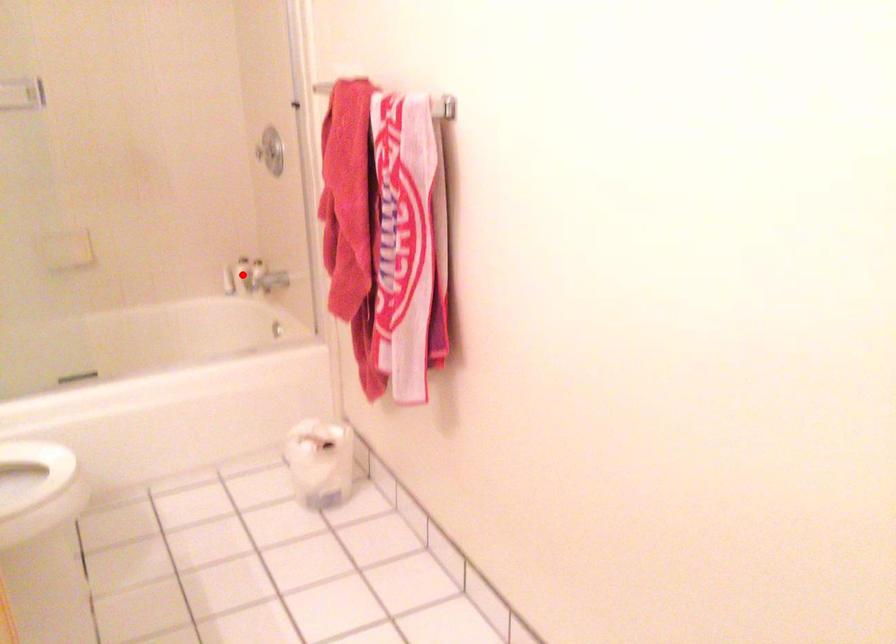
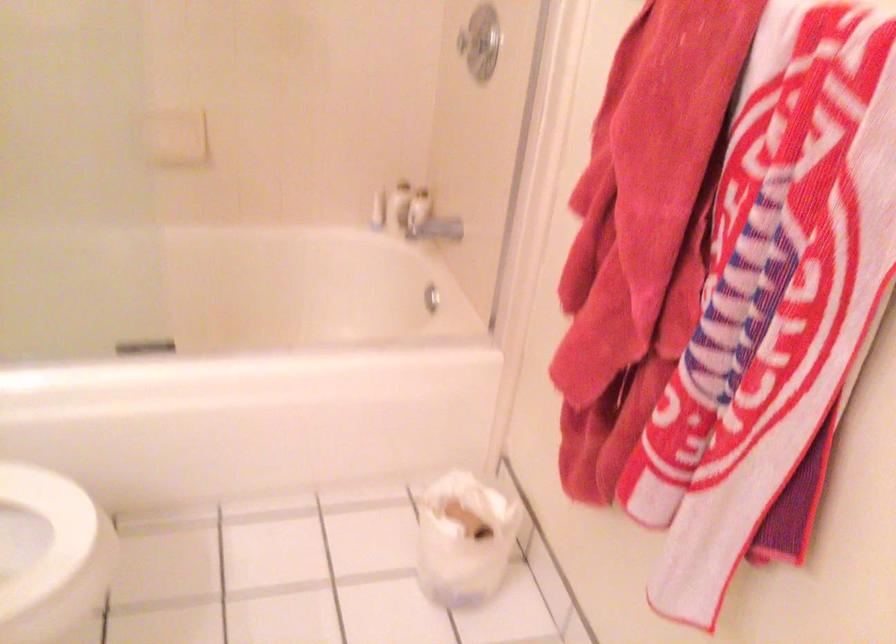
Question: I am providing you with two images of the same scene from different viewpoints. In image1, a red point is highlighted. Considering the same 3D point in image2, which of the following is correct?

Choices:
 (A) It is closer
 (B) It is farther

Answer: (A)